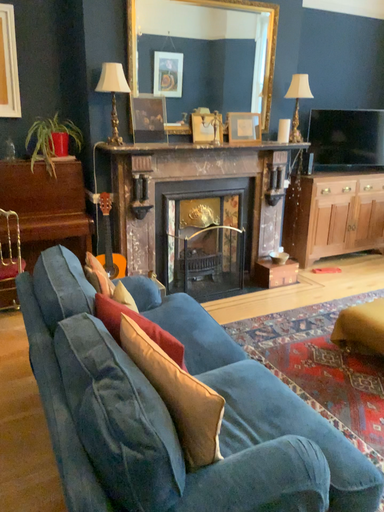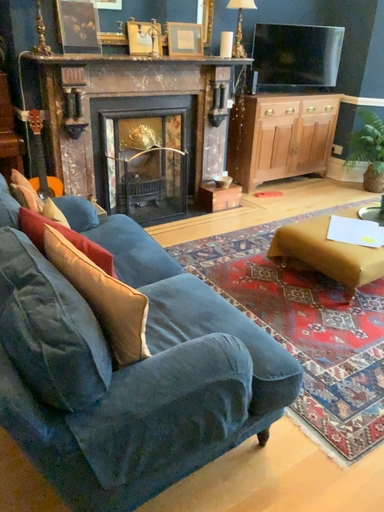
Question: Which way did the camera rotate in the video?

Choices:
 (A) rotated upward
 (B) rotated downward

Answer: (B)